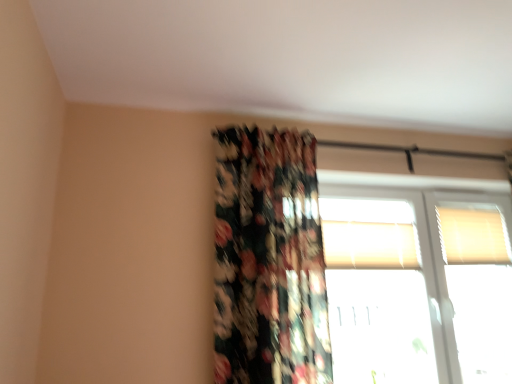
Question: Is transparent glass window at upper right, the third window when ordered from top to bottom, at the right side of white textured blinds at upper right, the 3th window positioned from the bottom?

Choices:
 (A) yes
 (B) no

Answer: (B)

Question: Does transparent glass window at upper right, marked as the 1th window in a bottom-to-top arrangement, have a smaller size compared to white textured blinds at upper right, the 3th window positioned from the bottom?

Choices:
 (A) no
 (B) yes

Answer: (A)

Question: Is transparent glass window at upper right, marked as the 1th window in a bottom-to-top arrangement, thinner than white textured blinds at upper right, the 3th window positioned from the bottom?

Choices:
 (A) no
 (B) yes

Answer: (A)

Question: Is transparent glass window at upper right, the third window when ordered from top to bottom, to the left of white textured blinds at upper right, the 3th window positioned from the bottom, from the viewer's perspective?

Choices:
 (A) yes
 (B) no

Answer: (A)

Question: From the image's perspective, does transparent glass window at upper right, marked as the 1th window in a bottom-to-top arrangement, appear lower than white textured blinds at upper right, positioned as the first window in top-to-bottom order?

Choices:
 (A) yes
 (B) no

Answer: (A)

Question: From a real-world perspective, is transparent glass window at upper right, marked as the 1th window in a bottom-to-top arrangement, over white textured blinds at upper right, the 3th window positioned from the bottom?

Choices:
 (A) no
 (B) yes

Answer: (A)

Question: Does transparent glass window at upper right, the third window when ordered from top to bottom, have a lesser height compared to floral fabric curtain at center?

Choices:
 (A) no
 (B) yes

Answer: (B)

Question: Considering the relative positions of transparent glass window at upper right, the third window when ordered from top to bottom, and floral fabric curtain at center in the image provided, is transparent glass window at upper right, the third window when ordered from top to bottom, to the left of floral fabric curtain at center from the viewer's perspective?

Choices:
 (A) yes
 (B) no

Answer: (B)

Question: Can you confirm if transparent glass window at upper right, the third window when ordered from top to bottom, is taller than floral fabric curtain at center?

Choices:
 (A) yes
 (B) no

Answer: (B)

Question: Is transparent glass window at upper right, the third window when ordered from top to bottom, bigger than floral fabric curtain at center?

Choices:
 (A) yes
 (B) no

Answer: (B)

Question: Can you confirm if transparent glass window at upper right, marked as the 1th window in a bottom-to-top arrangement, is smaller than floral fabric curtain at center?

Choices:
 (A) no
 (B) yes

Answer: (B)

Question: Does transparent glass window at upper right, marked as the 1th window in a bottom-to-top arrangement, have a greater width compared to white textured blinds at upper center, the second window ordered from the bottom?

Choices:
 (A) no
 (B) yes

Answer: (B)